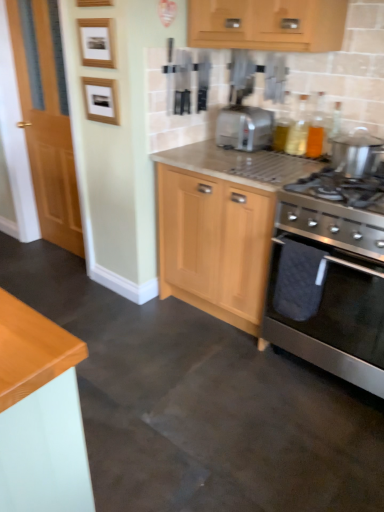
Question: From a real-world perspective, does wooden picture frame at upper left, which ranks as the second picture frame in bottom-to-top order, stand above wooden picture frame at upper left, the first picture frame from the bottom?

Choices:
 (A) no
 (B) yes

Answer: (B)

Question: Considering the relative sizes of wooden picture frame at upper left, which appears as the 1th picture frame when viewed from the top, and wooden picture frame at upper left, positioned as the second picture frame in top-to-bottom order, in the image provided, is wooden picture frame at upper left, which appears as the 1th picture frame when viewed from the top, smaller than wooden picture frame at upper left, positioned as the second picture frame in top-to-bottom order,?

Choices:
 (A) yes
 (B) no

Answer: (B)

Question: Would you say wooden picture frame at upper left, which appears as the 1th picture frame when viewed from the top, contains wooden picture frame at upper left, the first picture frame from the bottom?

Choices:
 (A) no
 (B) yes

Answer: (A)

Question: Is the position of wooden picture frame at upper left, which appears as the 1th picture frame when viewed from the top, more distant than that of wooden picture frame at upper left, the first picture frame from the bottom?

Choices:
 (A) no
 (B) yes

Answer: (A)

Question: Is wooden picture frame at upper left, which ranks as the second picture frame in bottom-to-top order, to the right of wooden picture frame at upper left, the first picture frame from the bottom, from the viewer's perspective?

Choices:
 (A) yes
 (B) no

Answer: (A)

Question: Is wooden picture frame at upper left, which ranks as the second picture frame in bottom-to-top order, at the left side of wooden picture frame at upper left, positioned as the second picture frame in top-to-bottom order?

Choices:
 (A) yes
 (B) no

Answer: (B)

Question: Does stainless steel gas stove at right have a smaller size compared to translucent glass bottles at upper right, arranged as the 2th bottle when viewed from the left?

Choices:
 (A) no
 (B) yes

Answer: (A)

Question: Considering the relative sizes of stainless steel gas stove at right and translucent glass bottles at upper right, arranged as the 2th bottle when viewed from the left, in the image provided, is stainless steel gas stove at right thinner than translucent glass bottles at upper right, arranged as the 2th bottle when viewed from the left,?

Choices:
 (A) no
 (B) yes

Answer: (A)

Question: From a real-world perspective, is stainless steel gas stove at right physically below translucent glass bottles at upper right, arranged as the 2th bottle when viewed from the left?

Choices:
 (A) yes
 (B) no

Answer: (A)

Question: Is stainless steel gas stove at right facing towards translucent glass bottles at upper right, arranged as the 2th bottle when viewed from the left?

Choices:
 (A) yes
 (B) no

Answer: (B)

Question: Considering the relative positions of stainless steel gas stove at right and translucent glass bottles at upper right, the first bottle from the right, in the image provided, is stainless steel gas stove at right behind translucent glass bottles at upper right, the first bottle from the right,?

Choices:
 (A) no
 (B) yes

Answer: (A)

Question: Considering the relative positions of stainless steel gas stove at right and translucent glass bottles at upper right, arranged as the 2th bottle when viewed from the left, in the image provided, is stainless steel gas stove at right to the left of translucent glass bottles at upper right, arranged as the 2th bottle when viewed from the left, from the viewer's perspective?

Choices:
 (A) yes
 (B) no

Answer: (B)

Question: Is stainless steel gas stove at right directly adjacent to stainless steel oven at lower right?

Choices:
 (A) no
 (B) yes

Answer: (A)